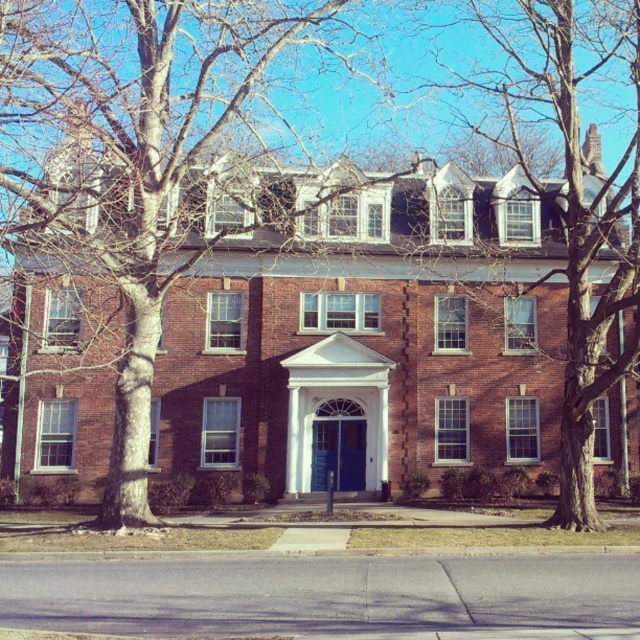
Question: Is bare bark tree at center wider than bare wood tree at upper right?

Choices:
 (A) no
 (B) yes

Answer: (A)

Question: Which of the following is the closest to the observer?

Choices:
 (A) 3,216
 (B) 577,163

Answer: (A)

Question: Is bare bark tree at center further to the viewer compared to bare wood tree at upper right?

Choices:
 (A) no
 (B) yes

Answer: (A)

Question: Which object appears farthest from the camera in this image?

Choices:
 (A) bare wood tree at upper right
 (B) bare bark tree at center

Answer: (A)

Question: Does bare bark tree at center have a smaller size compared to bare wood tree at upper right?

Choices:
 (A) yes
 (B) no

Answer: (A)